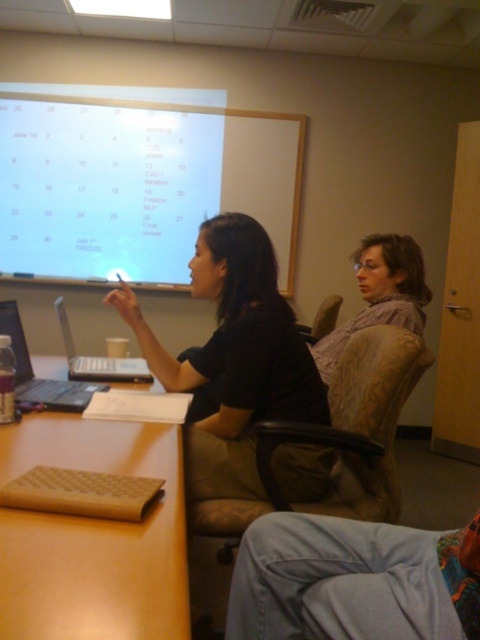
Who is taller, white matte projection screen at upper center or brown leather table at center?

With more height is white matte projection screen at upper center.

Who is more distant from viewer, (112, 134) or (57, 465)?

The point (112, 134) is behind.

Does point (45, 244) lie behind point (26, 532)?

Yes, it is.

At what (x,y) coordinates should I click in order to perform the action: click on white matte projection screen at upper center. Please return your answer as a coordinate pair (x, y). Looking at the image, I should click on coord(137,186).

Is brown leather table at center positioned before black matte shirt at center?

That is True.

Describe the element at coordinates (94, 538) in the screenshot. The height and width of the screenshot is (640, 480). I see `brown leather table at center` at that location.

Who is more forward, (36, 417) or (240, 243)?

Point (36, 417)

In order to click on brown leather table at center in this screenshot , I will do `click(94, 538)`.

Describe the element at coordinates (233, 358) in the screenshot. I see `black matte shirt at center` at that location.

Is point (321, 396) positioned behind point (57, 304)?

No, it is not.

Between point (211, 438) and point (69, 356), which one is positioned behind?

Positioned behind is point (69, 356).

Where is `black matte shirt at center`? This screenshot has width=480, height=640. black matte shirt at center is located at coordinates (233, 358).